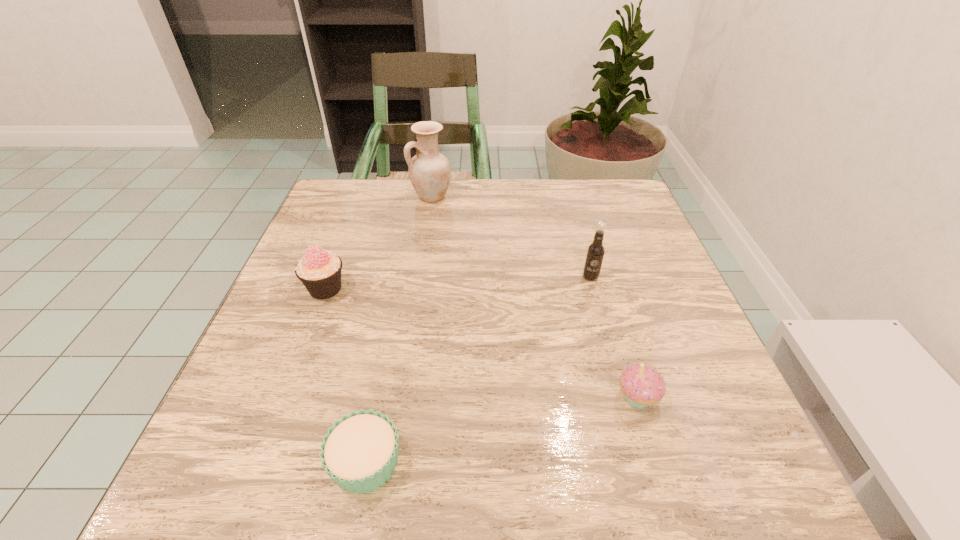
Find the location of a particular element. The height and width of the screenshot is (540, 960). unoccupied position between the farthest cupcake and the root beer is located at coordinates pyautogui.click(x=458, y=282).

The height and width of the screenshot is (540, 960). In order to click on free spot between the root beer and the second farthest cupcake in this screenshot , I will do `click(613, 337)`.

Locate an element on the screen. free point between the farthest cupcake and the pottery is located at coordinates (378, 242).

In order to click on vacant point located between the leftmost cupcake and the fourth shortest object in this screenshot , I will do `click(458, 282)`.

You are a GUI agent. You are given a task and a screenshot of the screen. Output one action in this format:
    pyautogui.click(x=<x>, y=<y>)
    Task: Click on the object that can be found as the second closest to the second nearest cupcake
    The height and width of the screenshot is (540, 960).
    Given the screenshot: What is the action you would take?
    pyautogui.click(x=360, y=452)

Locate which object is the closest to the leftmost cupcake. Please provide its 2D coordinates. Your answer should be formatted as a tuple, i.e. [(x, y)], where the tuple contains the x and y coordinates of a point satisfying the conditions above.

[(429, 171)]

Identify which cupcake is located as the nearest to the shortest cupcake. Please provide its 2D coordinates. Your answer should be formatted as a tuple, i.e. [(x, y)], where the tuple contains the x and y coordinates of a point satisfying the conditions above.

[(319, 270)]

Select which cupcake appears as the closest to the second cupcake from right to left. Please provide its 2D coordinates. Your answer should be formatted as a tuple, i.e. [(x, y)], where the tuple contains the x and y coordinates of a point satisfying the conditions above.

[(319, 270)]

Locate an element on the screen. vacant space that satisfies the following two spatial constraints: 1. on the label of the rightmost cupcake; 2. on the left side of the root beer is located at coordinates (624, 397).

Find the location of a particular element. free space that satisfies the following two spatial constraints: 1. on the label of the second farthest cupcake; 2. on the left side of the root beer is located at coordinates (624, 397).